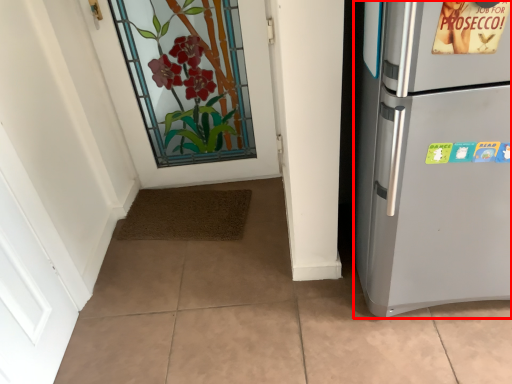
Question: Observing the image, what is the correct spatial positioning of refrigerator (annotated by the red box) in reference to door?

Choices:
 (A) right
 (B) left

Answer: (A)